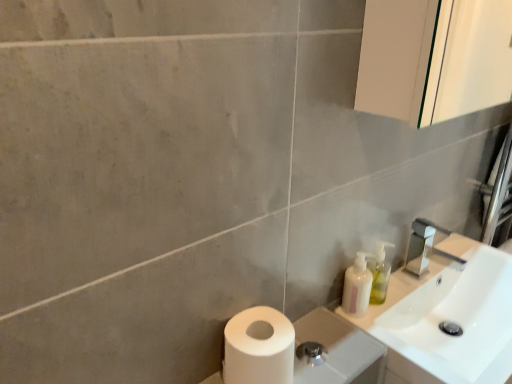
Question: From the image's perspective, would you say translucent plastic soap dispenser at right is positioned over translucent plastic soap dispenser at right?

Choices:
 (A) no
 (B) yes

Answer: (A)

Question: Is translucent plastic soap dispenser at right to the left of translucent plastic soap dispenser at right from the viewer's perspective?

Choices:
 (A) yes
 (B) no

Answer: (A)

Question: Can you confirm if translucent plastic soap dispenser at right is wider than translucent plastic soap dispenser at right?

Choices:
 (A) yes
 (B) no

Answer: (B)

Question: Is translucent plastic soap dispenser at right positioned with its back to translucent plastic soap dispenser at right?

Choices:
 (A) yes
 (B) no

Answer: (B)

Question: Could you tell me if translucent plastic soap dispenser at right is turned towards translucent plastic soap dispenser at right?

Choices:
 (A) no
 (B) yes

Answer: (A)

Question: Considering the positions of white matte toilet paper at lower left and translucent plastic soap dispenser at right in the image, is white matte toilet paper at lower left wider or thinner than translucent plastic soap dispenser at right?

Choices:
 (A) wide
 (B) thin

Answer: (A)

Question: Considering their positions, is white matte toilet paper at lower left located in front of or behind translucent plastic soap dispenser at right?

Choices:
 (A) front
 (B) behind

Answer: (A)

Question: Is white matte toilet paper at lower left to the left or to the right of translucent plastic soap dispenser at right in the image?

Choices:
 (A) right
 (B) left

Answer: (B)

Question: Is point (332, 375) positioned closer to the camera than point (374, 296)?

Choices:
 (A) closer
 (B) farther

Answer: (A)

Question: From a real-world perspective, relative to white matte toilet paper at lower left, is translucent plastic soap dispenser at right vertically above or below?

Choices:
 (A) below
 (B) above

Answer: (B)

Question: Would you say translucent plastic soap dispenser at right is inside or outside white matte toilet paper at lower left?

Choices:
 (A) outside
 (B) inside

Answer: (A)

Question: In the image, is translucent plastic soap dispenser at right positioned in front of or behind white matte toilet paper at lower left?

Choices:
 (A) behind
 (B) front

Answer: (A)

Question: Based on their positions, is translucent plastic soap dispenser at right located to the left or right of white matte toilet paper at lower left?

Choices:
 (A) left
 (B) right

Answer: (B)

Question: In terms of width, does translucent plastic soap dispenser at right look wider or thinner when compared to white matte toilet paper at lower left?

Choices:
 (A) thin
 (B) wide

Answer: (A)

Question: Is translucent plastic soap dispenser at right in front of or behind white matte toilet paper at lower left in the image?

Choices:
 (A) front
 (B) behind

Answer: (B)